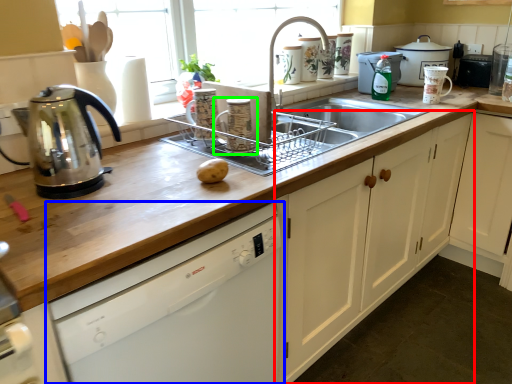
Question: Which object is positioned farthest from cabinetry (highlighted by a red box)? Select from dishwasher (highlighted by a blue box) and appliance (highlighted by a green box).

Choices:
 (A) dishwasher
 (B) appliance

Answer: (B)